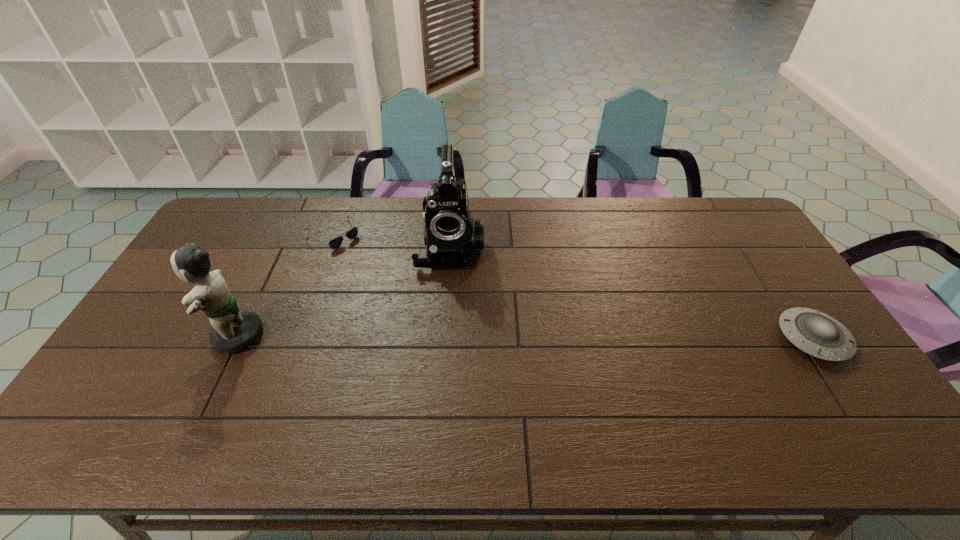
The width and height of the screenshot is (960, 540). I want to click on empty space that is in between the sunglasses and the figurine, so click(285, 285).

Where is `empty space between the figurine and the second object from left to right`? The width and height of the screenshot is (960, 540). empty space between the figurine and the second object from left to right is located at coordinates (285, 285).

I want to click on vacant area between the sunglasses and the third object from left to right, so click(x=393, y=241).

Where is `free space between the sunglasses and the leftmost object`? The height and width of the screenshot is (540, 960). free space between the sunglasses and the leftmost object is located at coordinates (285, 285).

This screenshot has width=960, height=540. What are the coordinates of `vacant area between the figurine and the third object from right to left` in the screenshot? It's located at (285, 285).

Find the location of `free space between the third object from right to left and the second object from right to left`. free space between the third object from right to left and the second object from right to left is located at coordinates (393, 241).

What are the coordinates of `free spot between the sunglasses and the saucer` in the screenshot? It's located at (574, 287).

Find the location of a particular element. vacant region between the camcorder and the rightmost object is located at coordinates (632, 292).

At what (x,y) coordinates should I click in order to perform the action: click on free space that is in between the camcorder and the figurine. Please return your answer as a coordinate pair (x, y). Looking at the image, I should click on (343, 291).

Where is `vacant space that's between the rightmost object and the sunglasses`? vacant space that's between the rightmost object and the sunglasses is located at coordinates (574, 287).